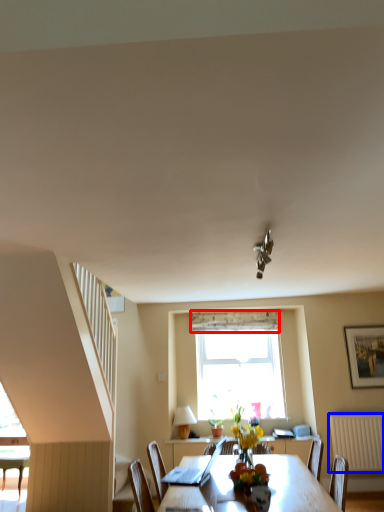
Question: Which object appears farthest to the camera in this image, curtain (highlighted by a red box) or radiator (highlighted by a blue box)?

Choices:
 (A) curtain
 (B) radiator

Answer: (A)